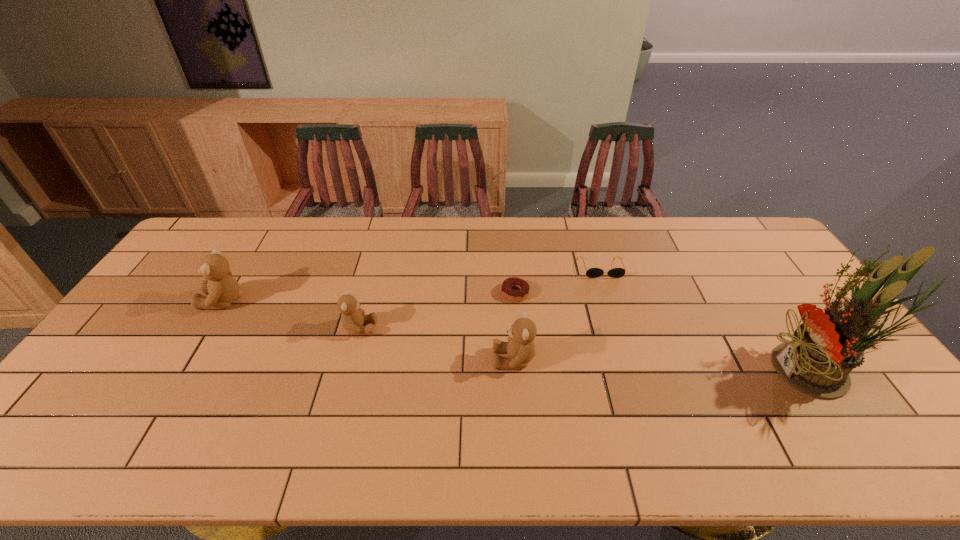
Identify the location of flower arrangement. Image resolution: width=960 pixels, height=540 pixels. (826, 347).

At what (x,y) coordinates should I click in order to perform the action: click on free region located on the front-facing side of the leftmost object. Please return your answer as a coordinate pair (x, y). Looking at the image, I should click on (154, 301).

This screenshot has width=960, height=540. I want to click on free spot located 0.120m on the front-facing side of the second object from left to right, so click(418, 328).

Where is `vacant space situated 0.350m on the front-facing side of the nearest teddy bear`? vacant space situated 0.350m on the front-facing side of the nearest teddy bear is located at coordinates (363, 360).

Locate an element on the screen. The image size is (960, 540). free space located on the front-facing side of the nearest teddy bear is located at coordinates (363, 360).

Where is `vacant area located on the front-facing side of the nearest teddy bear`? Image resolution: width=960 pixels, height=540 pixels. vacant area located on the front-facing side of the nearest teddy bear is located at coordinates (x=370, y=360).

Image resolution: width=960 pixels, height=540 pixels. What are the coordinates of `vacant space located on the front-facing side of the sunglasses` in the screenshot? It's located at (622, 336).

You are a GUI agent. You are given a task and a screenshot of the screen. Output one action in this format:
    pyautogui.click(x=<x>, y=<y>)
    Task: Click on the free space located on the left of the doughnut
    
    Given the screenshot: What is the action you would take?
    pyautogui.click(x=401, y=293)

This screenshot has height=540, width=960. Find the location of `blank area located 0.200m in front of the flower arrangement with the fan visible`. blank area located 0.200m in front of the flower arrangement with the fan visible is located at coordinates (694, 372).

What are the coordinates of `vacant space located 0.380m in front of the flower arrangement with the fan visible` in the screenshot? It's located at (625, 372).